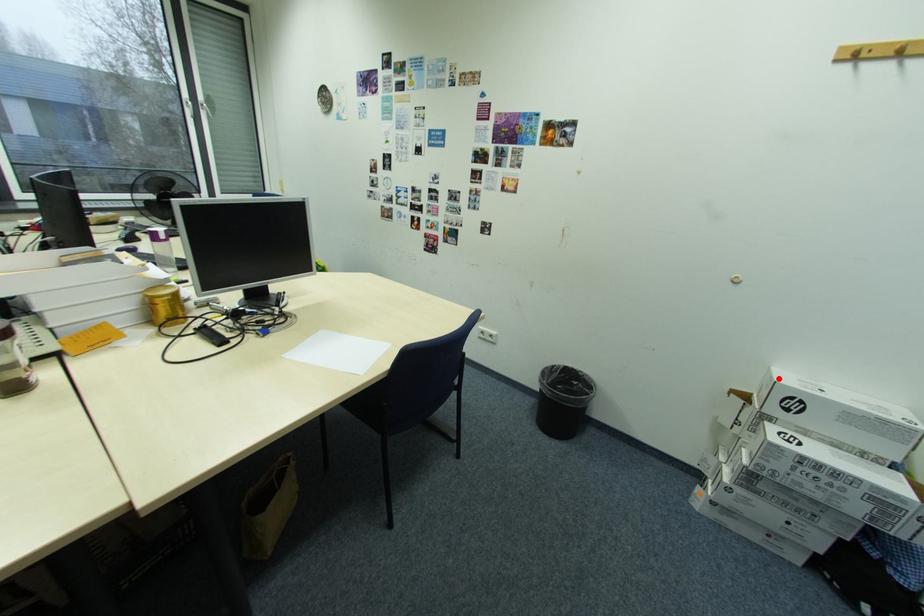
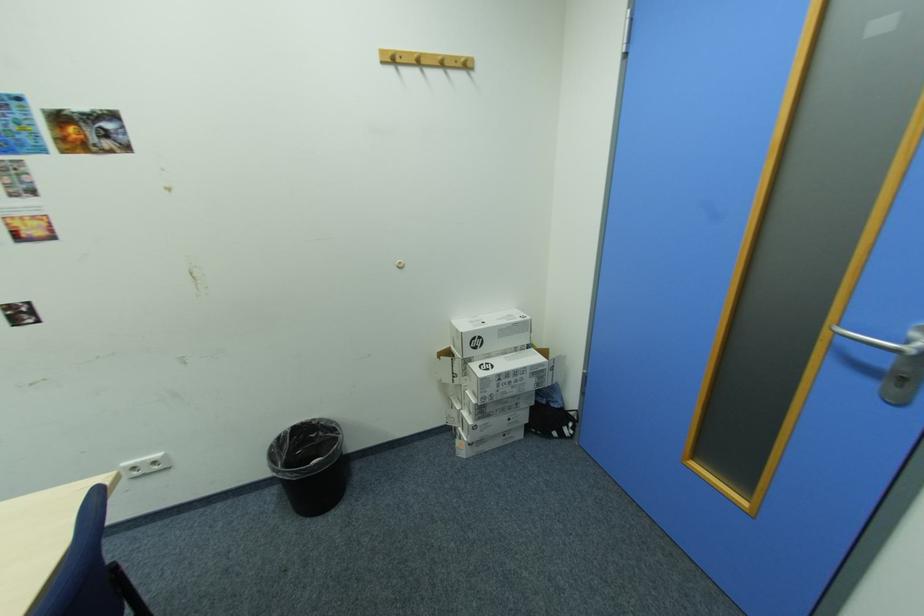
Find the pixel in the second image that matches the highlighted location in the first image.

(465, 331)